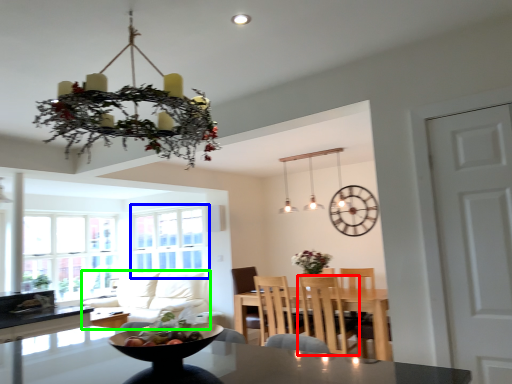
Question: Which is nearer to the chair (highlighted by a red box)? window screen (highlighted by a blue box) or couch (highlighted by a green box).

Choices:
 (A) window screen
 (B) couch

Answer: (B)